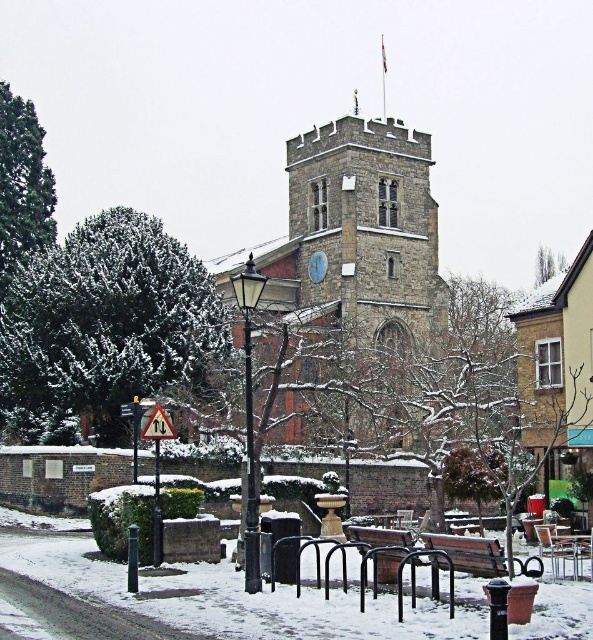
Question: Estimate the real-world distances between objects in this image. Which object is closer to the wooden park bench at center?

Choices:
 (A) wooden bench at center
 (B) stone clock tower at center

Answer: (A)

Question: Does stone clock tower at center have a greater width compared to wooden bench at center?

Choices:
 (A) yes
 (B) no

Answer: (A)

Question: Which object appears farthest from the camera in this image?

Choices:
 (A) wooden bench at center
 (B) stone clock tower at center

Answer: (B)

Question: Observing the image, what is the correct spatial positioning of wooden bench at center in reference to wooden park bench at center?

Choices:
 (A) below
 (B) above

Answer: (B)

Question: Among these points, which one is farthest from the camera?

Choices:
 (A) (359, 538)
 (B) (447, 550)
 (C) (283, 440)

Answer: (C)

Question: Does wooden bench at center have a lesser width compared to wooden park bench at center?

Choices:
 (A) yes
 (B) no

Answer: (B)